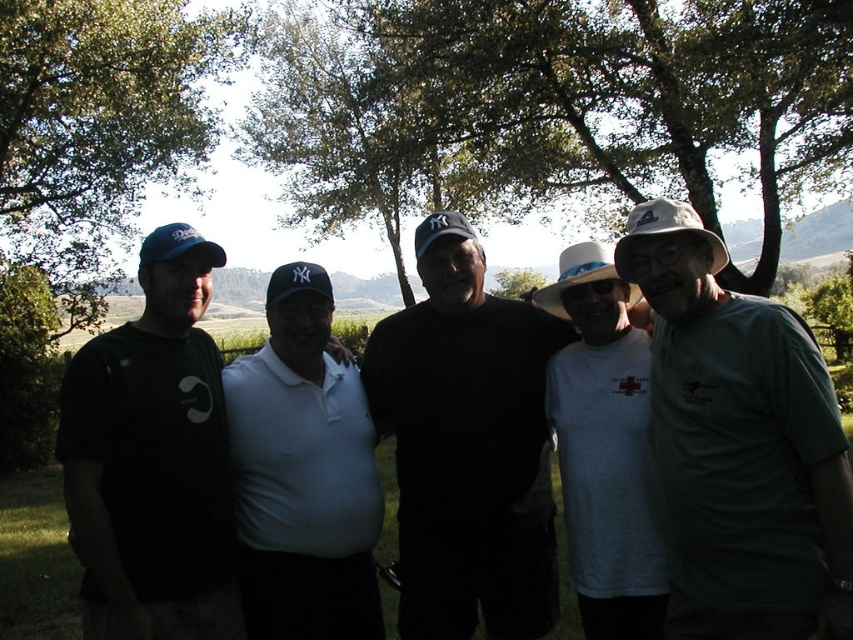
You are standing in the park and see a point at coordinates (738, 445). According to the image, which object is this point located on?

The point at (738, 445) is located on the green matte shirt at right.

You are planning to take a photo of the white matte polo shirt at center. Considering the green leafy tree at center is in the background, will the tree block the view of the shirt?

The green leafy tree at center might be wider than white matte polo shirt at center, so it could potentially block the view depending on their exact positions and angles.